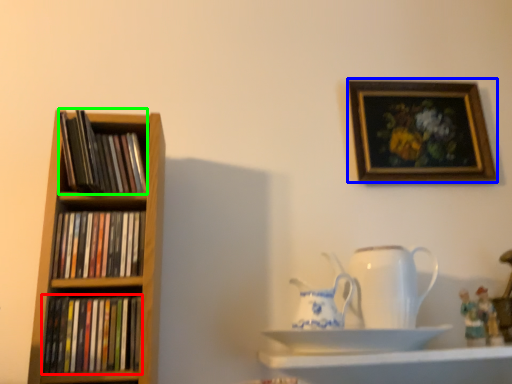
Question: Which object is positioned farthest from book (highlighted by a red box)? Select from picture frame (highlighted by a blue box) and book (highlighted by a green box).

Choices:
 (A) picture frame
 (B) book

Answer: (A)